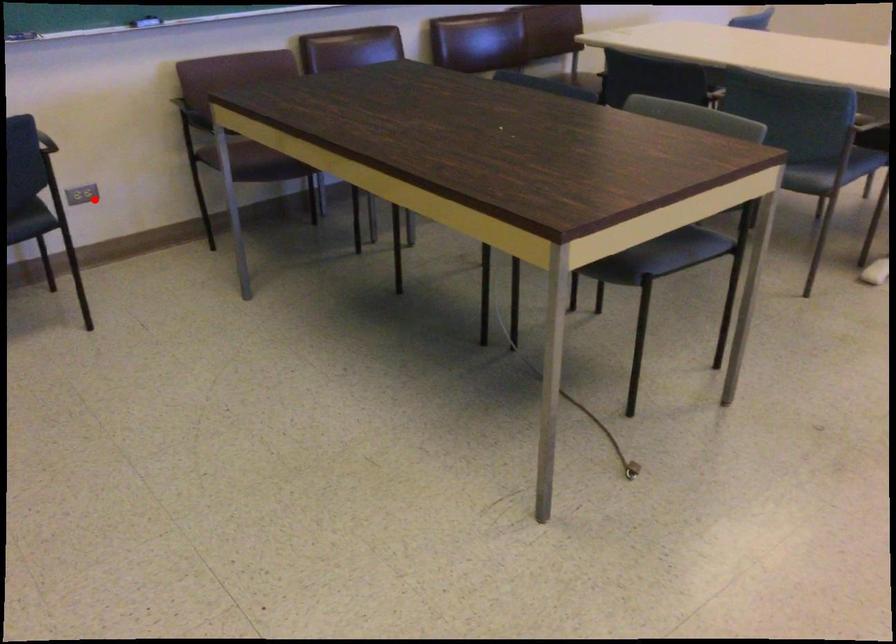
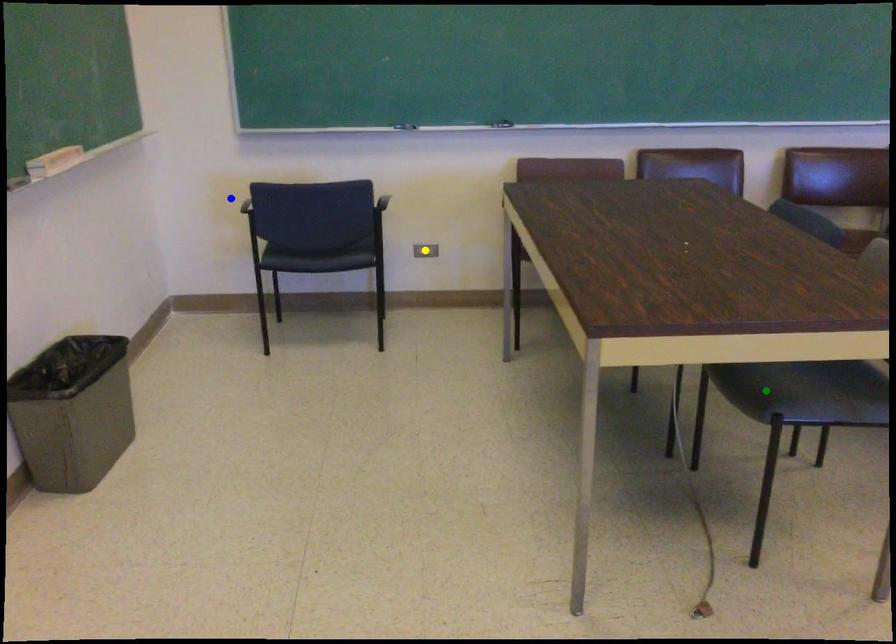
Question: I am providing you with two images of the same scene from different viewpoints. A red point is marked on the first image. You are given multiple points on the second image. Which point in image 2 is actually the same real-world point as the red point in image 1?

Choices:
 (A) green point
 (B) blue point
 (C) yellow point

Answer: (C)